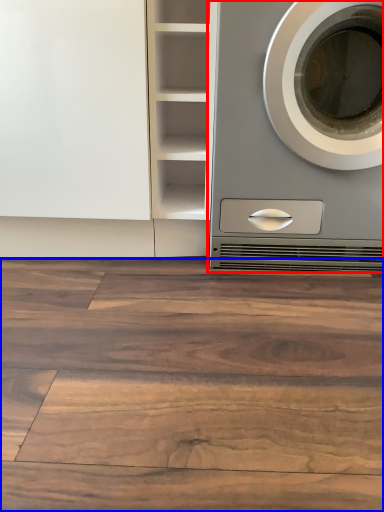
Question: Which point is closer to the camera, washing machine (highlighted by a red box) or hardwood (highlighted by a blue box)?

Choices:
 (A) washing machine
 (B) hardwood

Answer: (B)